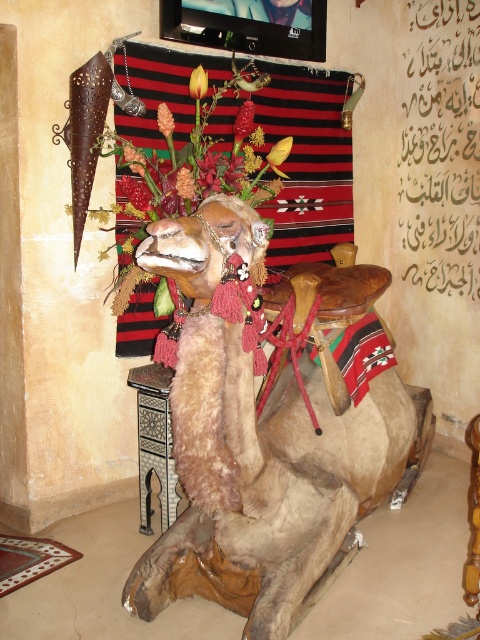
Question: Which point is farther to the camera?

Choices:
 (A) (195, 83)
 (B) (250, 442)
 (C) (237, 138)

Answer: (C)

Question: Does smooth yellow flower at center appear under orange matte flower at upper center?

Choices:
 (A) no
 (B) yes

Answer: (B)

Question: Can you confirm if black paper at upper right is positioned below floral bouquet at upper center?

Choices:
 (A) no
 (B) yes

Answer: (A)

Question: Which point is closer to the camera?

Choices:
 (A) (203, 88)
 (B) (175, 154)
 (C) (276, 168)
 (D) (384, 426)

Answer: (D)

Question: Which point is farther to the camera?

Choices:
 (A) (259, 260)
 (B) (241, 384)

Answer: (A)

Question: Does smooth red flower at upper center have a greater width compared to smooth red flower at center?

Choices:
 (A) yes
 (B) no

Answer: (A)